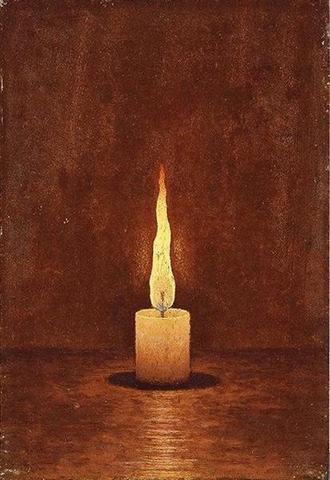
The height and width of the screenshot is (480, 330). What are the coordinates of `the front of candle` in the screenshot? It's located at (170, 342).